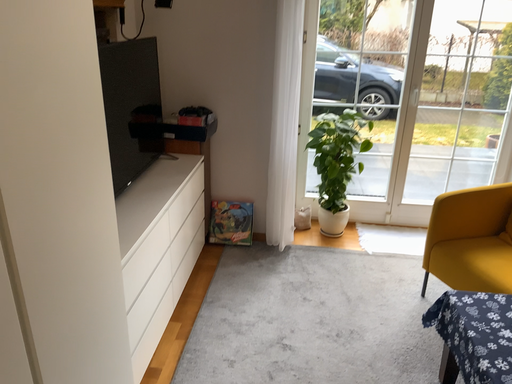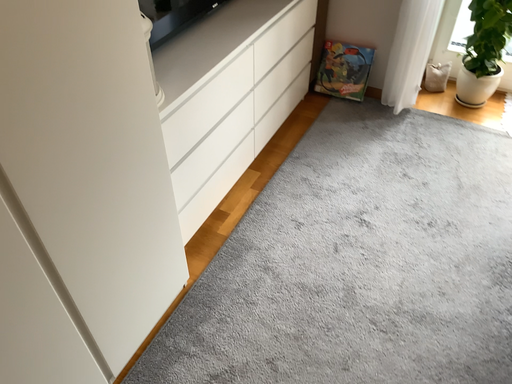
Question: How did the camera likely rotate when shooting the video?

Choices:
 (A) rotated upward
 (B) rotated downward

Answer: (B)